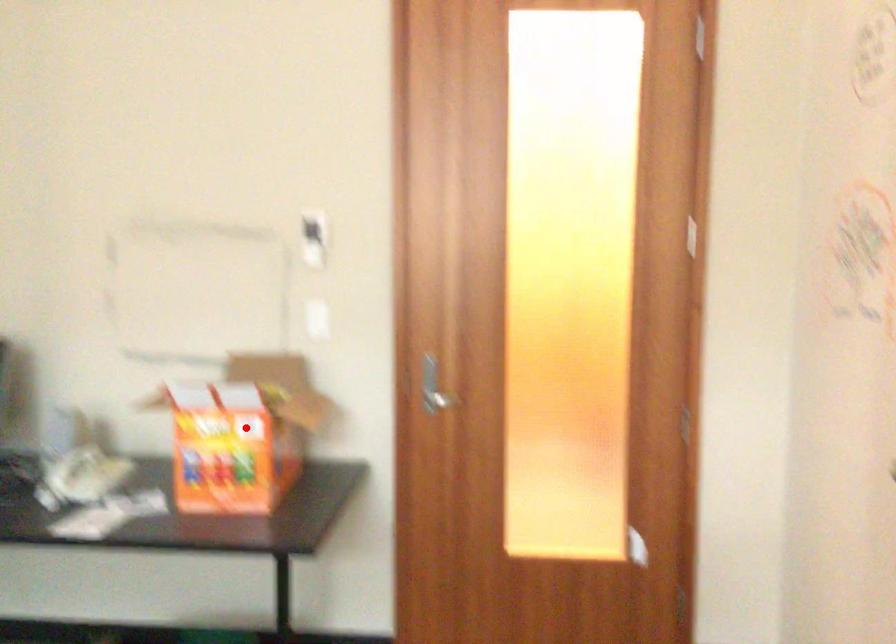
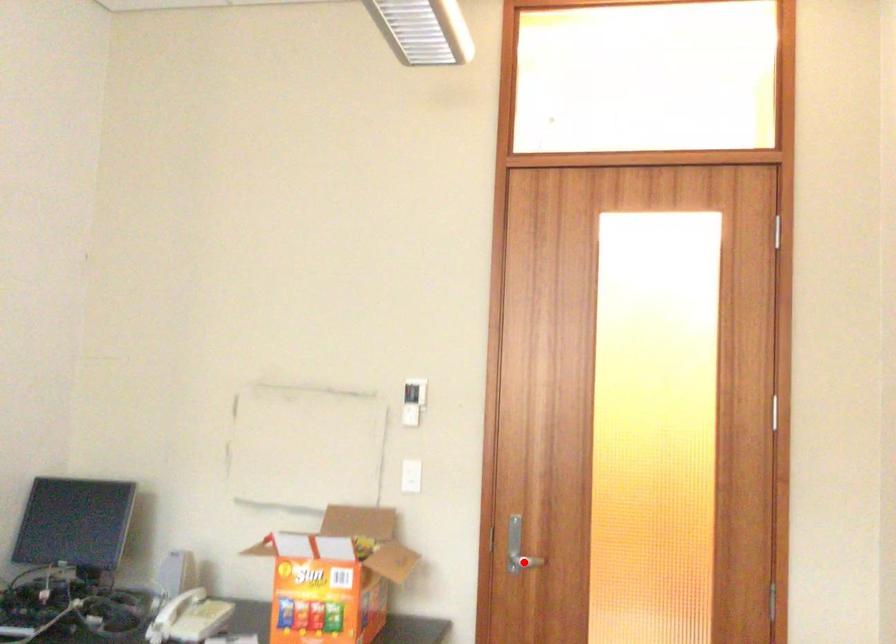
I am providing you with two images of the same scene from different viewpoints. A red point is marked on the first image and another point is marked on the second image. Are the points marked in image1 and image2 representing the same 3D position?

No